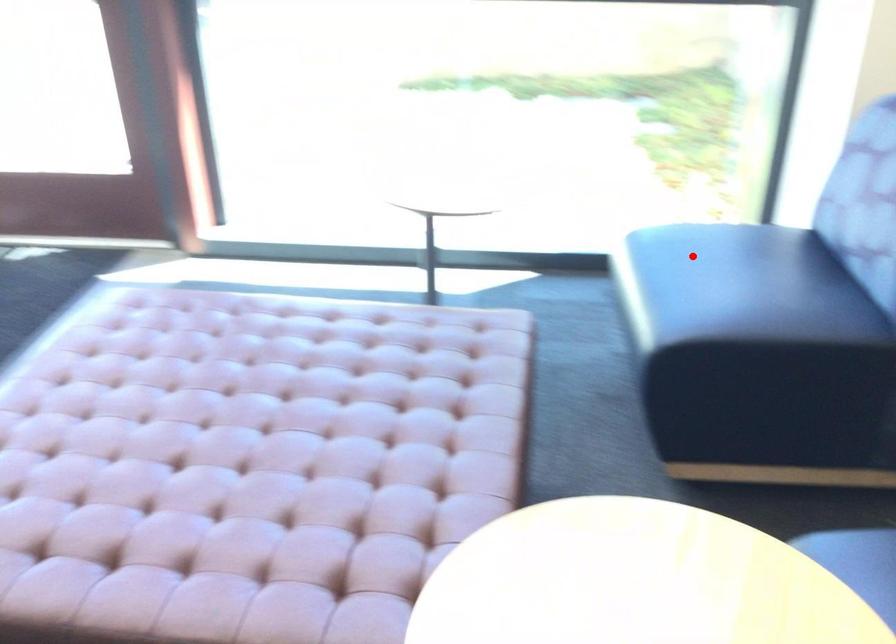
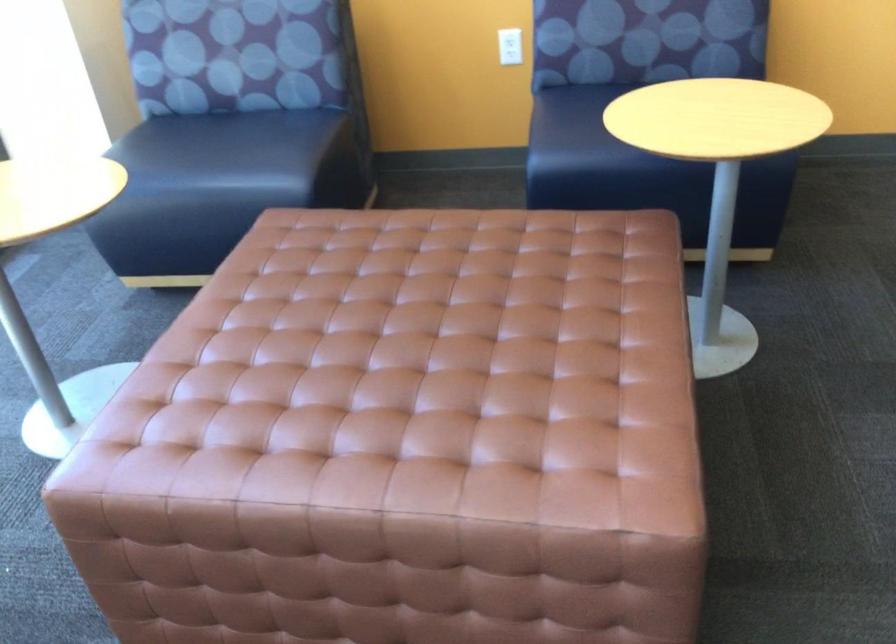
In the second image, find the point that corresponds to the highlighted location in the first image.

(199, 149)